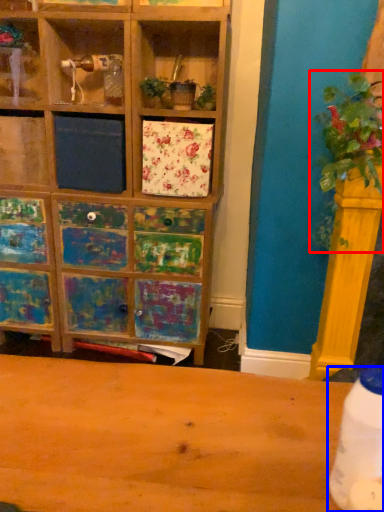
Question: Which of the following is the closest to the observer, floral arrangement (highlighted by a red box) or bottle (highlighted by a blue box)?

Choices:
 (A) floral arrangement
 (B) bottle

Answer: (B)